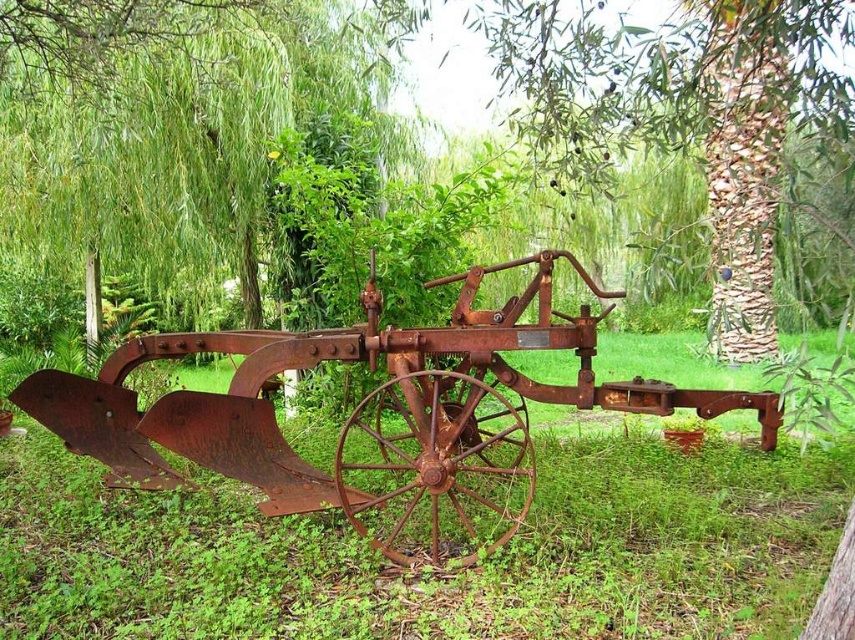
Can you confirm if rusty metal tractor at center is bigger than rusty metal tree at center?

Result: No, rusty metal tractor at center is not bigger than rusty metal tree at center.

This screenshot has width=855, height=640. Describe the element at coordinates (369, 413) in the screenshot. I see `rusty metal tractor at center` at that location.

Find the location of `rusty metal tractor at center`. rusty metal tractor at center is located at coordinates (369, 413).